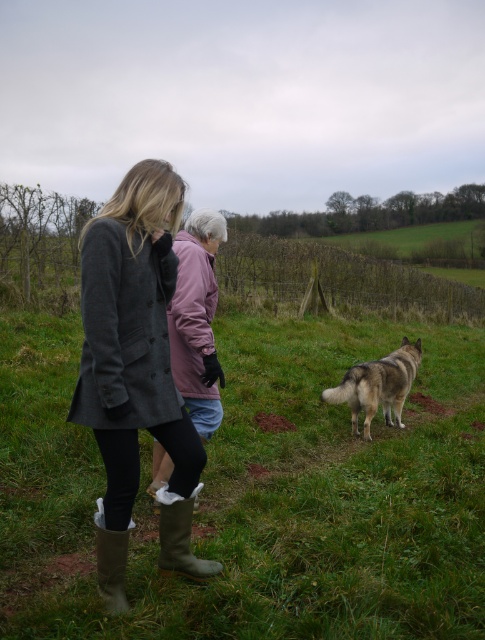
You are standing at point (370, 401) and want to walk to the other person at point (171, 516). Is the path clear between these two points?

Yes, the path between point (171, 516) and point (370, 401) is clear because point (171, 516) is in front of point (370, 401), so there are no obstructions blocking the way.